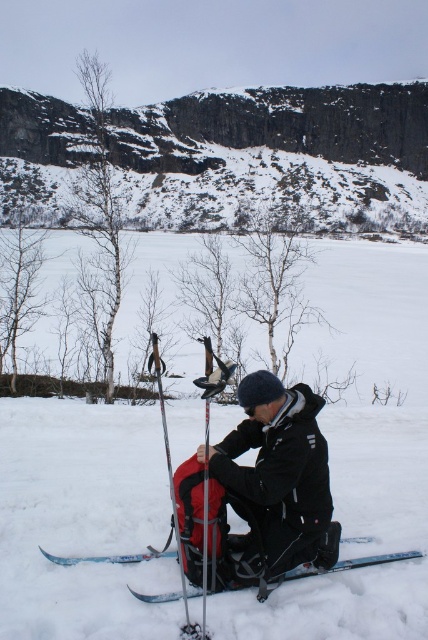
Between point (45, 515) and point (109, 561), which one is positioned in front?

Point (109, 561)

Is white matte snow at center positioned before blue metallic ski at lower center?

That is True.

Is point (80, 438) closer to camera compared to point (127, 561)?

No, (80, 438) is further to viewer.

Find the location of `white matte snow at center`. white matte snow at center is located at coordinates (82, 520).

Based on the photo, is matte black backpack at center to the left of matte black ski pole at center from the viewer's perspective?

Incorrect, matte black backpack at center is not on the left side of matte black ski pole at center.

Does matte black backpack at center have a smaller size compared to matte black ski pole at center?

Yes.

Who is more distant from viewer, (243,420) or (196,625)?

The point (243,420) is more distant.

Locate an element on the screen. This screenshot has width=428, height=640. matte black backpack at center is located at coordinates (276, 480).

Does white matte snow at center lie behind matte black backpack at center?

No, white matte snow at center is in front of matte black backpack at center.

Who is more distant from viewer, (x=332, y=598) or (x=258, y=563)?

The point (x=258, y=563) is behind.

I want to click on white matte snow at center, so click(82, 520).

Where is `white matte snow at center`? The height and width of the screenshot is (640, 428). white matte snow at center is located at coordinates (82, 520).